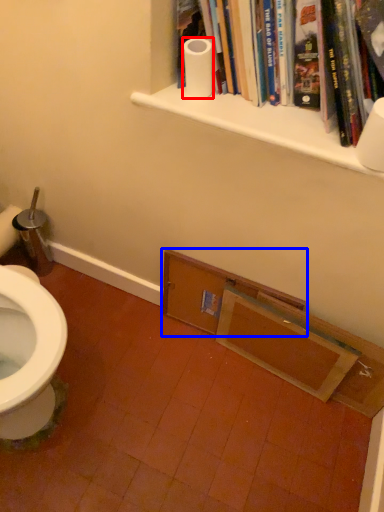
Question: Among these objects, which one is nearest to the camera, toilet paper (highlighted by a red box) or shelf (highlighted by a blue box)?

Choices:
 (A) toilet paper
 (B) shelf

Answer: (A)